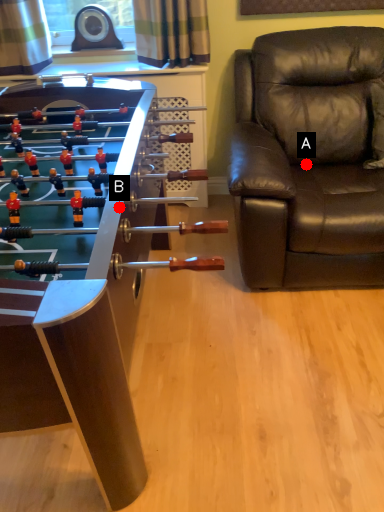
Question: Two points are circled on the image, labeled by A and B beside each circle. Which point is farther from the camera taking this photo?

Choices:
 (A) A is further
 (B) B is further

Answer: (A)